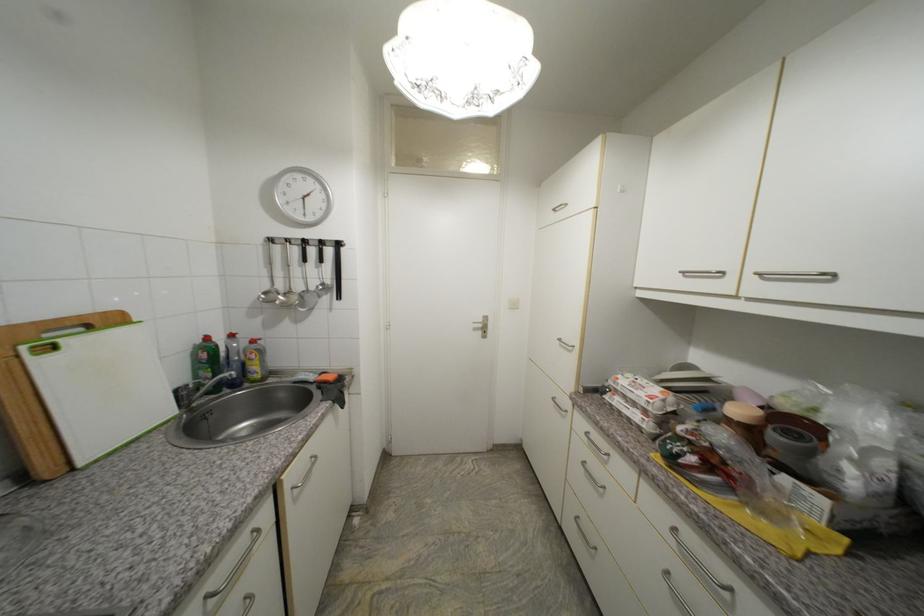
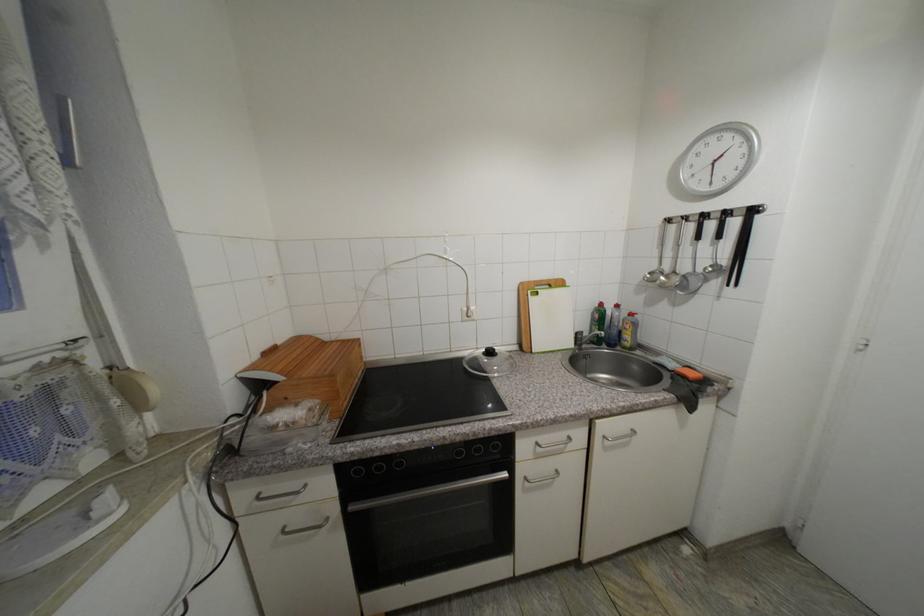
Question: The camera is either moving clockwise (left) or counter-clockwise (right) around the object. The first image is from the beginning of the video and the second image is from the end. Is the camera moving left or right when shooting the video?

Choices:
 (A) Left
 (B) Right

Answer: (B)